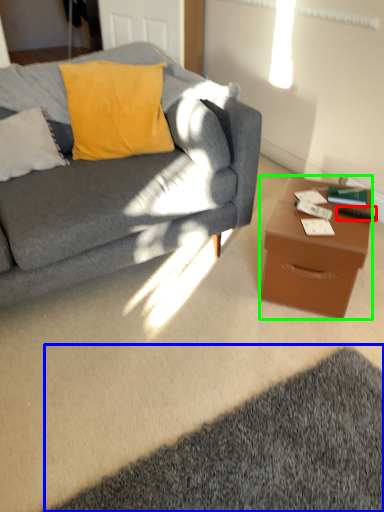
Question: Estimate the real-world distances between objects in this image. Which object is farther from remote control (highlighted by a red box), mat (highlighted by a blue box) or desk (highlighted by a green box)?

Choices:
 (A) mat
 (B) desk

Answer: (A)